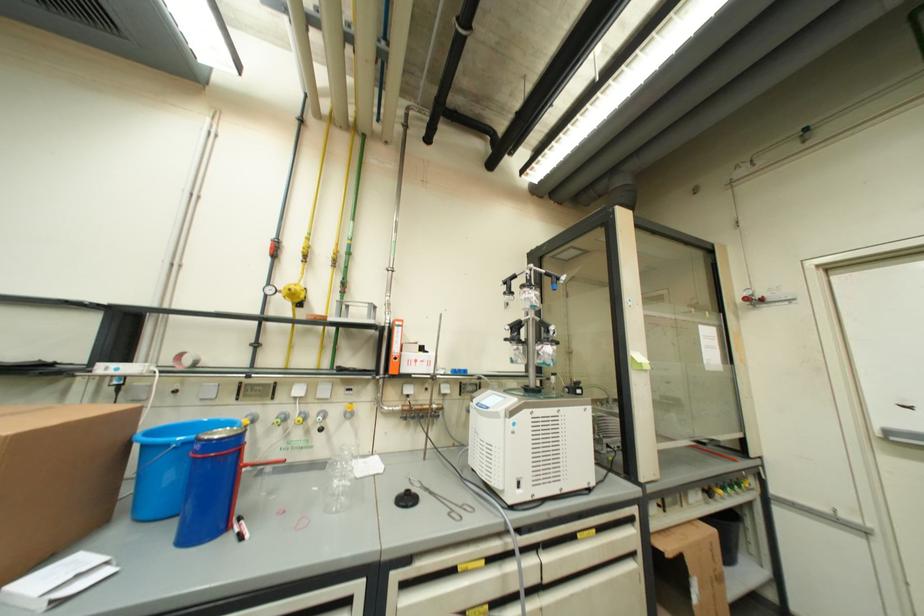
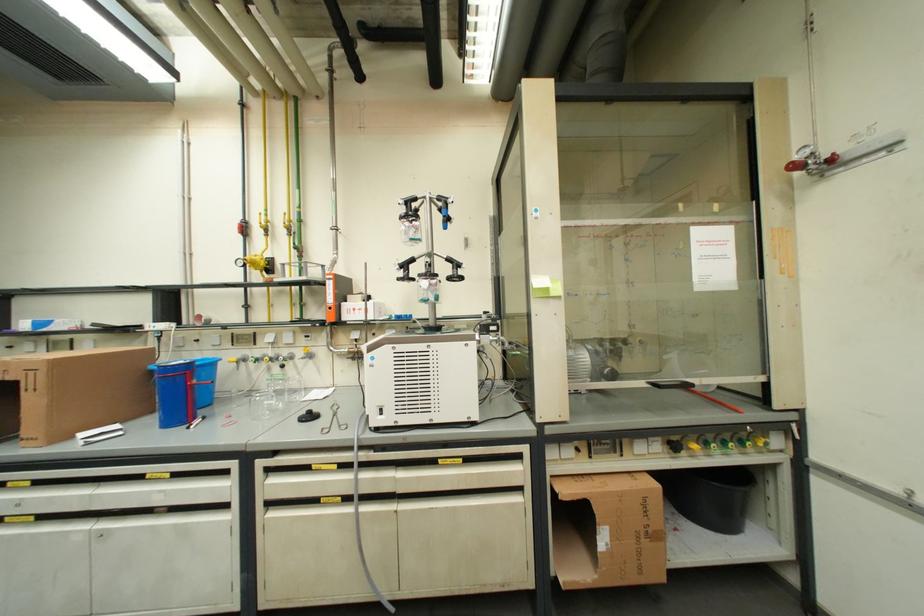
Question: In a continuous first-person perspective shot, in which direction is the camera moving?

Choices:
 (A) Left
 (B) Right
 (C) Forward
 (D) Backward

Answer: (B)